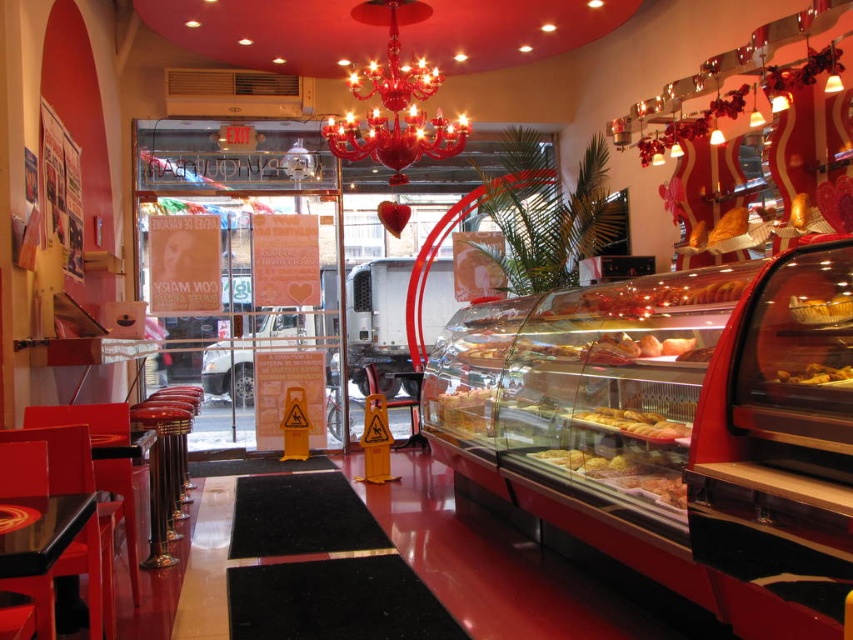
You are a customer at the bakery counter. You want to pick up the golden brown crusty bread at center and the golden crispy pastry at center. Which one is closer to you?

The golden brown crusty bread at center is closer to you than the golden crispy pastry at center.